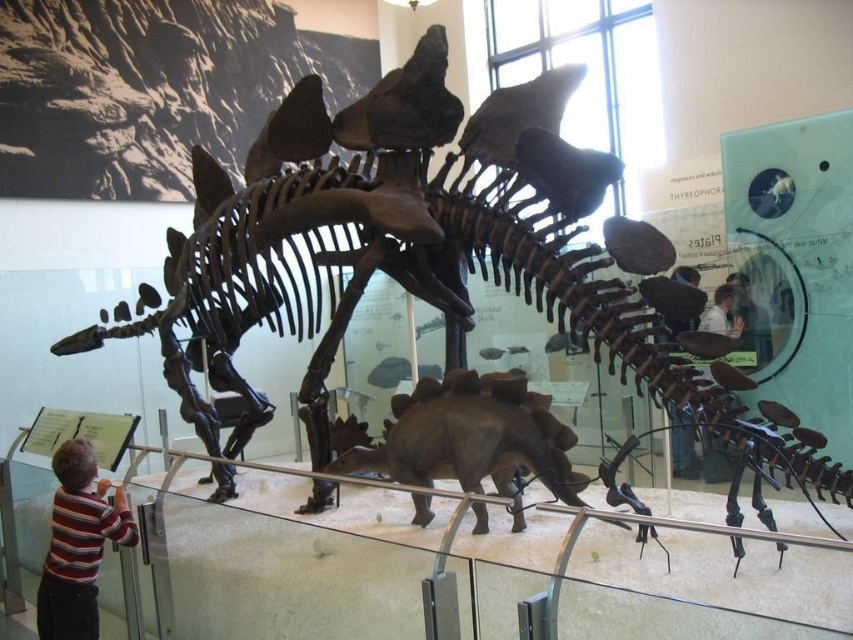
Identify the location of brown matte stegosaurus at center. Image resolution: width=853 pixels, height=640 pixels. (473, 438).